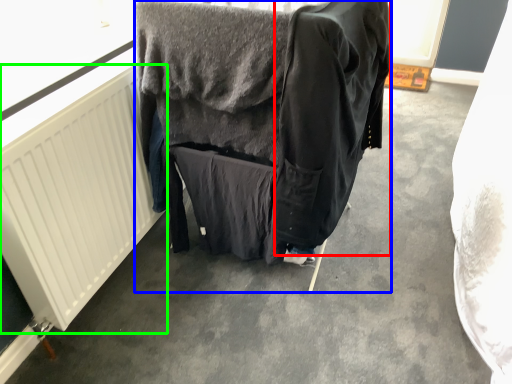
Question: Which object is the closest to the clothing (highlighted by a red box)? Choose among these: furniture (highlighted by a blue box) or radiator (highlighted by a green box).

Choices:
 (A) furniture
 (B) radiator

Answer: (A)